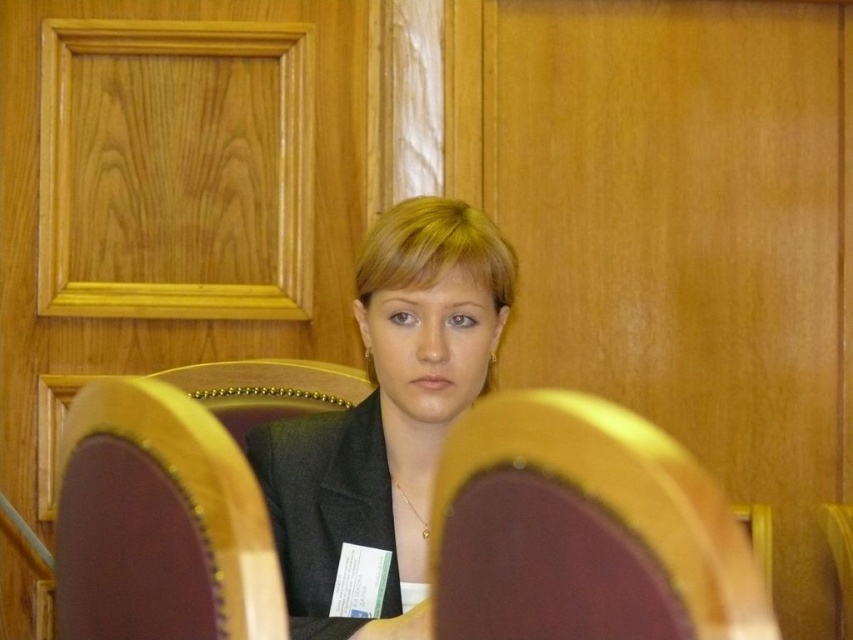
Question: Which of the following is the farthest from the observer?

Choices:
 (A) maroon fabric chair at center
 (B) matte black suit at center

Answer: (B)

Question: Is matte black suit at center below wooden polished chair at center?

Choices:
 (A) no
 (B) yes

Answer: (A)

Question: Which object is positioned farthest from the maroon fabric chair at center?

Choices:
 (A) wooden polished chair at center
 (B) matte black suit at center

Answer: (B)

Question: Which point is closer to the camera taking this photo?

Choices:
 (A) (485, 244)
 (B) (495, 531)

Answer: (B)

Question: Is maroon fabric chair at center bigger than matte black suit at center?

Choices:
 (A) no
 (B) yes

Answer: (A)

Question: Observing the image, what is the correct spatial positioning of matte black suit at center in reference to wooden polished chair at center?

Choices:
 (A) above
 (B) below

Answer: (A)